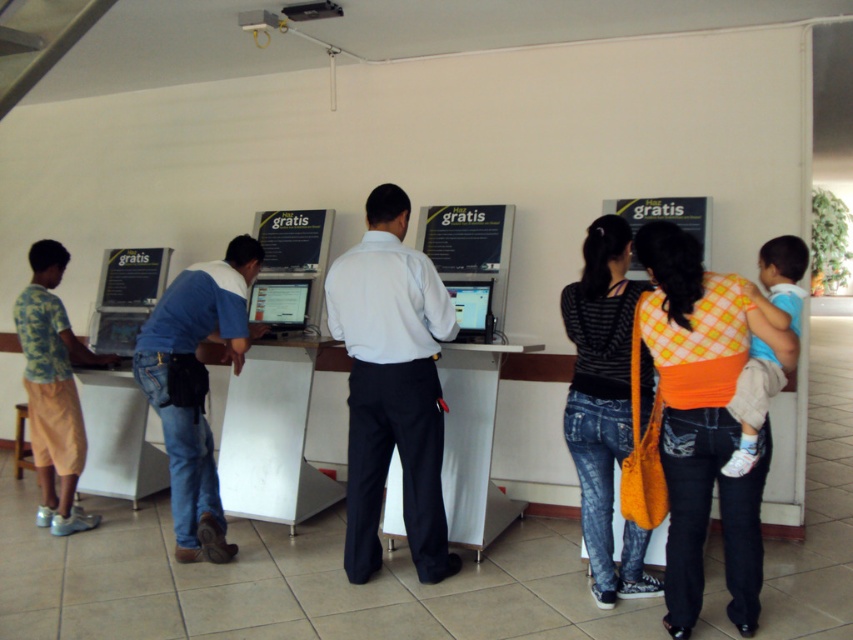
Is denim jeans at center further to camera compared to blue jeans at center?

No.

Where is `denim jeans at center`? The height and width of the screenshot is (640, 853). denim jeans at center is located at coordinates (602, 404).

Is point (619, 410) in front of point (227, 291)?

That is True.

This screenshot has height=640, width=853. What are the coordinates of `denim jeans at center` in the screenshot? It's located at click(602, 404).

Which is above, blue jeans at center or camo shirt at left?

blue jeans at center is higher up.

Is blue jeans at center positioned before camo shirt at left?

Yes.

At what (x,y) coordinates should I click in order to perform the action: click on blue jeans at center. Please return your answer as a coordinate pair (x, y). The image size is (853, 640). Looking at the image, I should click on (195, 387).

Who is higher up, white shirt at center or denim jeans at center?

white shirt at center is higher up.

Is the position of white shirt at center less distant than that of denim jeans at center?

No, it is behind denim jeans at center.

Is point (403, 282) in front of point (630, 428)?

No, it is behind (630, 428).

This screenshot has height=640, width=853. I want to click on white shirt at center, so click(x=392, y=387).